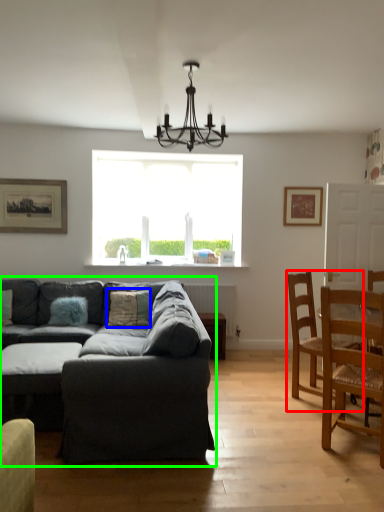
Question: Estimate the real-world distances between objects in this image. Which object is farther from chair (highlighted by a red box), pillow (highlighted by a blue box) or studio couch (highlighted by a green box)?

Choices:
 (A) pillow
 (B) studio couch

Answer: (A)